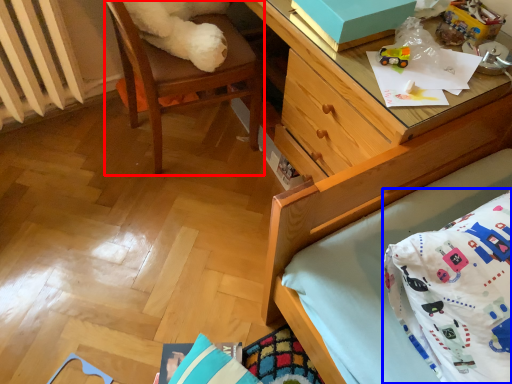
Question: Which point is closer to the camera, chair (highlighted by a red box) or throw pillow (highlighted by a blue box)?

Choices:
 (A) chair
 (B) throw pillow

Answer: (B)